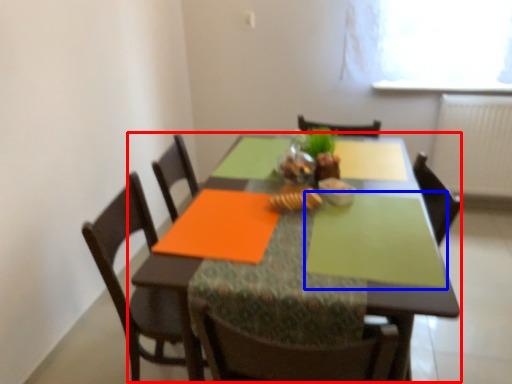
Question: Which object appears farthest to the camera in this image, kitchen & dining room table (highlighted by a red box) or place mat (highlighted by a blue box)?

Choices:
 (A) kitchen & dining room table
 (B) place mat

Answer: (B)